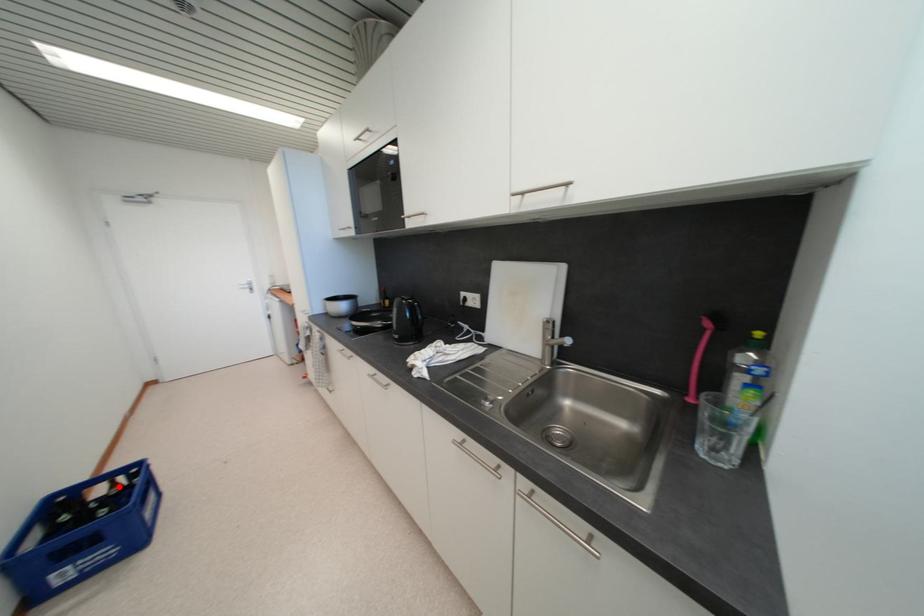
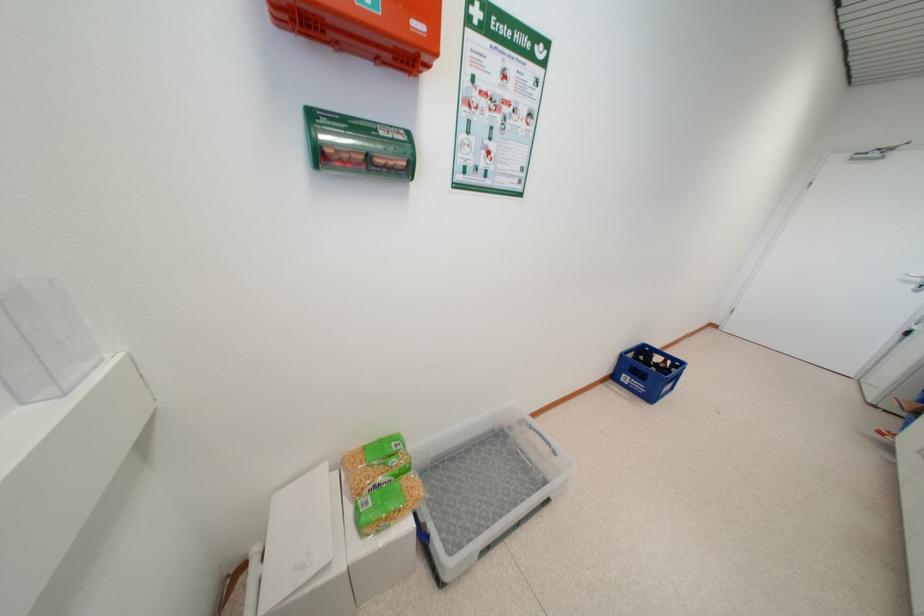
Find the pixel in the second image that matches the highlighted location in the first image.

(669, 363)